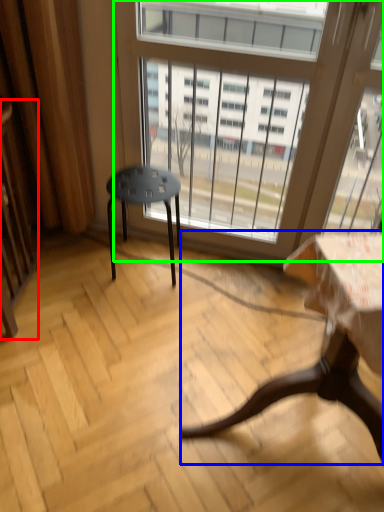
Question: Which object is the farthest from screen door (highlighted by a red box)? Choose among these: table (highlighted by a blue box) or window (highlighted by a green box).

Choices:
 (A) table
 (B) window

Answer: (A)